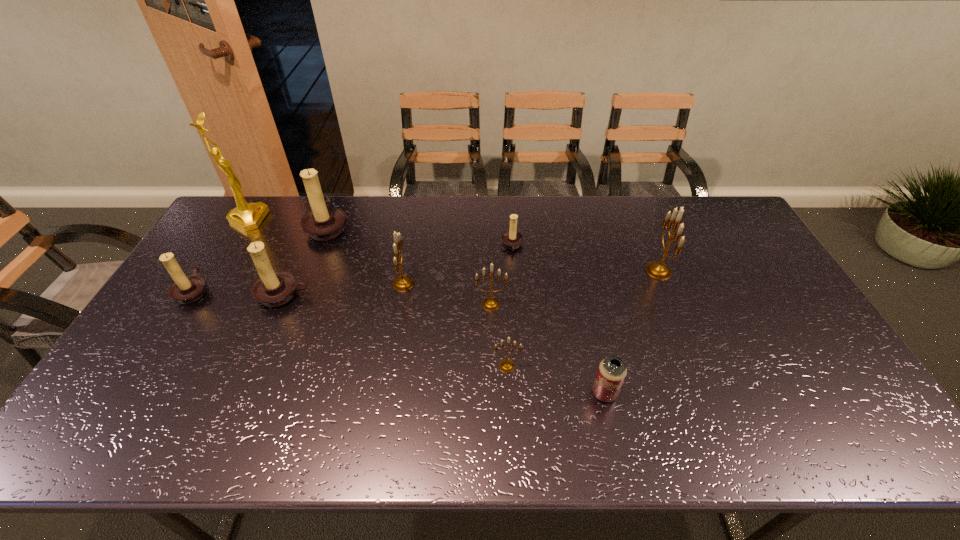
Find the location of a particular element. This screenshot has width=960, height=540. free location located on the wick of the third smallest brown candle holder is located at coordinates (246, 382).

Where is `vacant space located 0.270m on the right of the third biggest gold candelabrum`? The width and height of the screenshot is (960, 540). vacant space located 0.270m on the right of the third biggest gold candelabrum is located at coordinates (598, 304).

At what (x,y) coordinates should I click in order to perform the action: click on vacant space located 0.050m on the wick of the leftmost brown candle holder. Please return your answer as a coordinate pair (x, y). The image size is (960, 540). Looking at the image, I should click on (226, 291).

Where is `vacant area located on the wick of the rightmost brown candle holder`? vacant area located on the wick of the rightmost brown candle holder is located at coordinates (397, 246).

This screenshot has width=960, height=540. I want to click on vacant space located 0.270m on the wick of the rightmost brown candle holder, so click(x=421, y=246).

Where is `free space located on the wick of the rightmost brown candle holder`? Image resolution: width=960 pixels, height=540 pixels. free space located on the wick of the rightmost brown candle holder is located at coordinates (419, 246).

Where is `free location located 0.180m on the right of the nearest candelabrum`? free location located 0.180m on the right of the nearest candelabrum is located at coordinates (589, 366).

Find the location of a particular element. This screenshot has height=540, width=960. vacant position located on the right of the ninth object from left to right is located at coordinates (665, 393).

Locate an element on the screen. This screenshot has width=960, height=540. award that is positioned at the far edge is located at coordinates (247, 216).

Where is `candle holder that is at the far edge`? Image resolution: width=960 pixels, height=540 pixels. candle holder that is at the far edge is located at coordinates (324, 222).